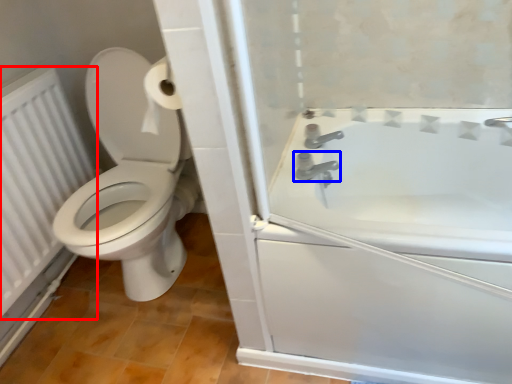
Question: Which of the following is the farthest to the observer, radiator (highlighted by a red box) or tap (highlighted by a blue box)?

Choices:
 (A) radiator
 (B) tap

Answer: (B)